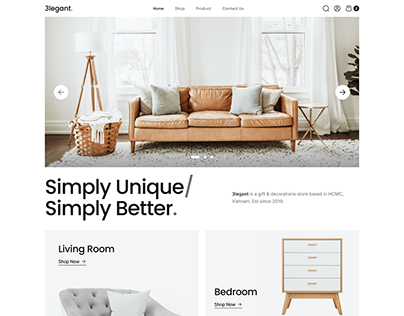
Locate an element on the screen. dresser is located at coordinates (308, 258).